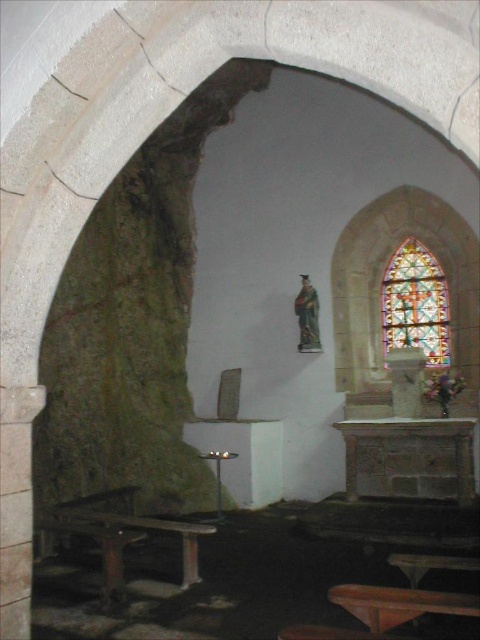
Who is more distant from viewer, [60,506] or [427,252]?

Point [427,252]

How distant is wooden picnic table at lower left from stained glass window at right?

A distance of 3.89 meters exists between wooden picnic table at lower left and stained glass window at right.

Does point (82, 513) come farther from viewer compared to point (420, 324)?

No, it is not.

I want to click on wooden picnic table at lower left, so click(118, 532).